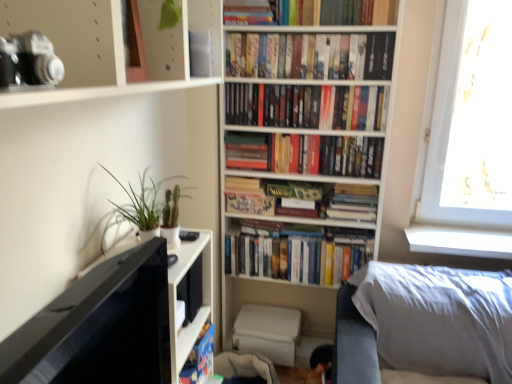
Measure the distance between point (247, 194) and camera.

The distance of point (247, 194) from camera is 2.18 meters.

Where is `hardcover books at upper center, the 1th book from the top`? Image resolution: width=512 pixels, height=384 pixels. hardcover books at upper center, the 1th book from the top is located at coordinates (345, 11).

Where is `hardcover books at center, which is counted as the fifth book, starting from the top`? hardcover books at center, which is counted as the fifth book, starting from the top is located at coordinates (296, 252).

Where is `hardcover book at center, arranged as the third paperback book when viewed from the right`? hardcover book at center, arranged as the third paperback book when viewed from the right is located at coordinates (246, 151).

Considering the sizes of hardcover book at center, arranged as the third paperback book when viewed from the right, and hardcover book at center, the 1th paperback book viewed from the right, in the image, is hardcover book at center, arranged as the third paperback book when viewed from the right, bigger or smaller than hardcover book at center, the 1th paperback book viewed from the right,?

Considering their sizes, hardcover book at center, arranged as the third paperback book when viewed from the right, takes up less space than hardcover book at center, the 1th paperback book viewed from the right.

From the image's perspective, which is above, hardcover book at center, arranged as the third paperback book when viewed from the right, or hardcover book at center, which is counted as the third paperback book, starting from the left?

From the image's view, hardcover book at center, arranged as the third paperback book when viewed from the right, is above.

Is point (237, 155) closer or farther from the camera than point (370, 207)?

Point (237, 155) is positioned farther from the camera compared to point (370, 207).

Looking at this image, measure the distance from hardcover book at center, arranged as the third paperback book when viewed from the right, to hardcover book at center, which is counted as the third paperback book, starting from the left.

hardcover book at center, arranged as the third paperback book when viewed from the right, is 18.92 inches away from hardcover book at center, which is counted as the third paperback book, starting from the left.

Does green matte plant at left have a smaller size compared to hardcover books at center, which ranks as the third book in top-to-bottom order?

Yes, green matte plant at left is smaller than hardcover books at center, which ranks as the third book in top-to-bottom order.

Does point (165, 198) come behind point (284, 109)?

No, (165, 198) is in front of (284, 109).

Starting from the green matte plant at left, which book is the 3rd one to the right? Please provide its 2D coordinates.

[(307, 106)]

From a real-world perspective, relative to hardcover books at center, which ranks as the third book in top-to-bottom order, is green matte plant at left vertically above or below?

In terms of real-world spatial position, green matte plant at left is below hardcover books at center, which ranks as the third book in top-to-bottom order.

Identify the location of pillow below the black glossy tv stand at lower left (from the image's perspective). (438, 318).

From the image's perspective, which one is positioned lower, white soft pillow at lower right or black glossy tv stand at lower left?

white soft pillow at lower right, from the image's perspective.

Can you confirm if white soft pillow at lower right is smaller than black glossy tv stand at lower left?

No, white soft pillow at lower right is not smaller than black glossy tv stand at lower left.

From a real-world perspective, relative to black glossy tv stand at lower left, is white soft pillow at lower right vertically above or below?

white soft pillow at lower right is situated lower than black glossy tv stand at lower left in the real world.

Between point (250, 198) and point (129, 353), which one is positioned behind?

Point (250, 198)

Can you confirm if hardcover book at center, which is the 2th paperback book in left-to-right order, is taller than black glossy tv stand at lower left?

No, hardcover book at center, which is the 2th paperback book in left-to-right order, is not taller than black glossy tv stand at lower left.

Is hardcover book at center, which is the 2th paperback book in left-to-right order, to the left of black glossy tv stand at lower left from the viewer's perspective?

In fact, hardcover book at center, which is the 2th paperback book in left-to-right order, is to the right of black glossy tv stand at lower left.

From a real-world perspective, between hardcover book at center, which is the 2th paperback book in left-to-right order, and black glossy tv stand at lower left, who is vertically lower?

black glossy tv stand at lower left, from a real-world perspective.

Can you tell me how much white matte bookshelf at center and hardcover books at upper center, which ranks as the second book in top-to-bottom order, differ in facing direction?

0.000496 degrees.

Which is behind, point (278, 70) or point (335, 50)?

Point (278, 70)

From the image's perspective, is white matte bookshelf at center located above or below hardcover books at upper center, positioned as the 4th book in bottom-to-top order?

From the image's perspective, white matte bookshelf at center appears below hardcover books at upper center, positioned as the 4th book in bottom-to-top order.

Based on the photo, considering the sizes of objects white matte bookshelf at center and hardcover books at upper center, positioned as the 4th book in bottom-to-top order, in the image provided, who is thinner, white matte bookshelf at center or hardcover books at upper center, positioned as the 4th book in bottom-to-top order,?

hardcover books at upper center, positioned as the 4th book in bottom-to-top order, is thinner.

Based on their sizes in the image, would you say hardcover books at center, which ranks as the third book in top-to-bottom order, is bigger or smaller than white soft pillow at lower right?

Considering their sizes, hardcover books at center, which ranks as the third book in top-to-bottom order, takes up less space than white soft pillow at lower right.

Would you say hardcover books at center, which ranks as the third book in top-to-bottom order, contains white soft pillow at lower right?

That's incorrect, white soft pillow at lower right is not inside hardcover books at center, which ranks as the third book in top-to-bottom order.

Which point is more forward, (345, 99) or (442, 350)?

Positioned in front is point (442, 350).

Can you tell me how much hardcover books at center, which ranks as the third book in top-to-bottom order, and white soft pillow at lower right differ in facing direction?

The angular difference between hardcover books at center, which ranks as the third book in top-to-bottom order, and white soft pillow at lower right is 0.000475 degrees.

Is point (251, 224) closer or farther from the camera than point (255, 167)?

Point (251, 224).

From the image's perspective, is hardcover books at center, which is counted as the fifth book, starting from the top, beneath hardcover books at center, acting as the 4th book starting from the top?

Yes, from the image's perspective, hardcover books at center, which is counted as the fifth book, starting from the top, is beneath hardcover books at center, acting as the 4th book starting from the top.

In the image, is hardcover books at center, which ranks as the first book in bottom-to-top order, on the left side or the right side of hardcover books at center, placed as the 2th book when sorted from bottom to top?

hardcover books at center, which ranks as the first book in bottom-to-top order, is to the left of hardcover books at center, placed as the 2th book when sorted from bottom to top.

Identify the location of paperback book in front of the hardcover book at center, which is counted as the third paperback book, starting from the left. (246, 151).

Identify the location of plant below the hardcover books at center, which ranks as the third book in top-to-bottom order (from the image's perspective). Image resolution: width=512 pixels, height=384 pixels. (144, 207).

Which object lies nearer to the anchor point hardcover books at center, which is counted as the fifth book, starting from the top, hardcover books at center, which ranks as the third book in top-to-bottom order, or hardcover book at center, which is the 2th paperback book in left-to-right order?

hardcover book at center, which is the 2th paperback book in left-to-right order, is closer to hardcover books at center, which is counted as the fifth book, starting from the top.

Looking at the image, which one is located further to hardcover books at center, acting as the 4th book starting from the top, black glossy tv stand at lower left or hardcover books at upper center, the fifth book ordered from the bottom?

Based on the image, black glossy tv stand at lower left appears to be further to hardcover books at center, acting as the 4th book starting from the top.

From the image, which object appears to be farther from white soft pillow at lower right, green matte plant at left or hardcover book at center, arranged as the third paperback book when viewed from the right?

green matte plant at left is further to white soft pillow at lower right.

Looking at the image, which one is located closer to black matte camera at upper left, white matte bookshelf at center or matte black camera at upper left?

matte black camera at upper left is closer to black matte camera at upper left.

Based on their spatial positions, is hardcover books at center, acting as the 4th book starting from the top, or black glossy tv stand at lower left further from hardcover books at upper center, which ranks as the second book in top-to-bottom order?

Based on the image, black glossy tv stand at lower left appears to be further to hardcover books at upper center, which ranks as the second book in top-to-bottom order.

When comparing their distances from white soft pillow at lower right, does hardcover book at center, placed as the 1th paperback book when sorted from left to right, or hardcover books at upper center, which ranks as the second book in top-to-bottom order, seem further?

The object further to white soft pillow at lower right is hardcover books at upper center, which ranks as the second book in top-to-bottom order.

From the image, which object appears to be farther from hardcover books at upper center, the fifth book ordered from the bottom, hardcover books at upper center, positioned as the 4th book in bottom-to-top order, or hardcover book at center, placed as the 2th paperback book when sorted from right to left?

hardcover book at center, placed as the 2th paperback book when sorted from right to left, lies further to hardcover books at upper center, the fifth book ordered from the bottom, than the other object.

Estimate the real-world distances between objects in this image. Which object is further from hardcover books at center, which ranks as the first book in bottom-to-top order, matte black camera at upper left or hardcover book at center, arranged as the third paperback book when viewed from the right?

matte black camera at upper left is positioned further to the anchor hardcover books at center, which ranks as the first book in bottom-to-top order.

Image resolution: width=512 pixels, height=384 pixels. I want to click on computer desk between matte black camera at upper left and hardcover books at center, placed as the 2th book when sorted from bottom to top, from front to back, so click(x=113, y=322).

Find the location of `computer desk situated between matte black camera at upper left and white soft pillow at lower right from left to right`. computer desk situated between matte black camera at upper left and white soft pillow at lower right from left to right is located at coordinates (113, 322).

In order to click on bookcase between black matte camera at upper left and hardcover books at center, which ranks as the first book in bottom-to-top order, in the front-back direction in this screenshot , I will do `click(310, 104)`.

In order to click on book between hardcover books at center, which ranks as the 3th book in bottom-to-top order, and hardcover books at center, which is counted as the fifth book, starting from the top, from top to bottom in this screenshot , I will do tap(305, 154).